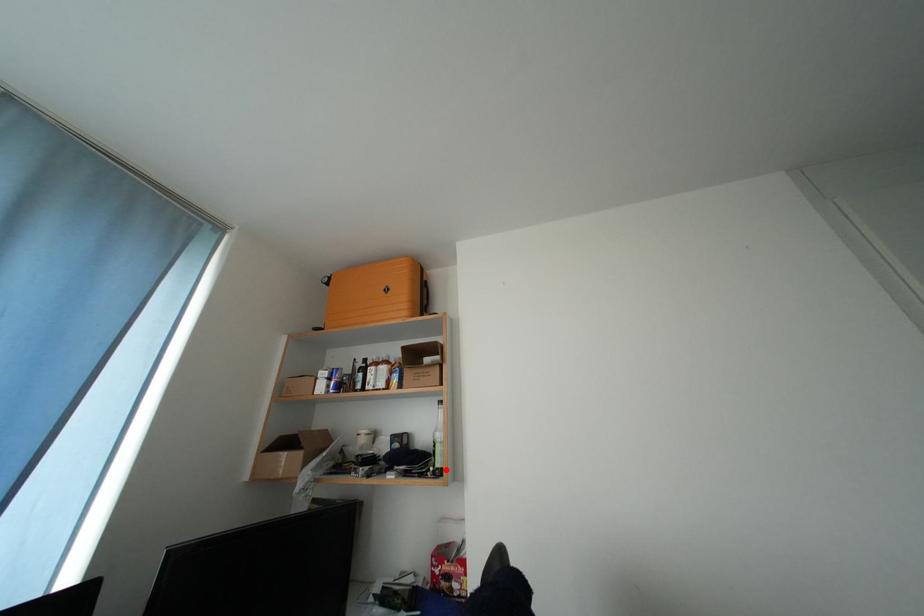
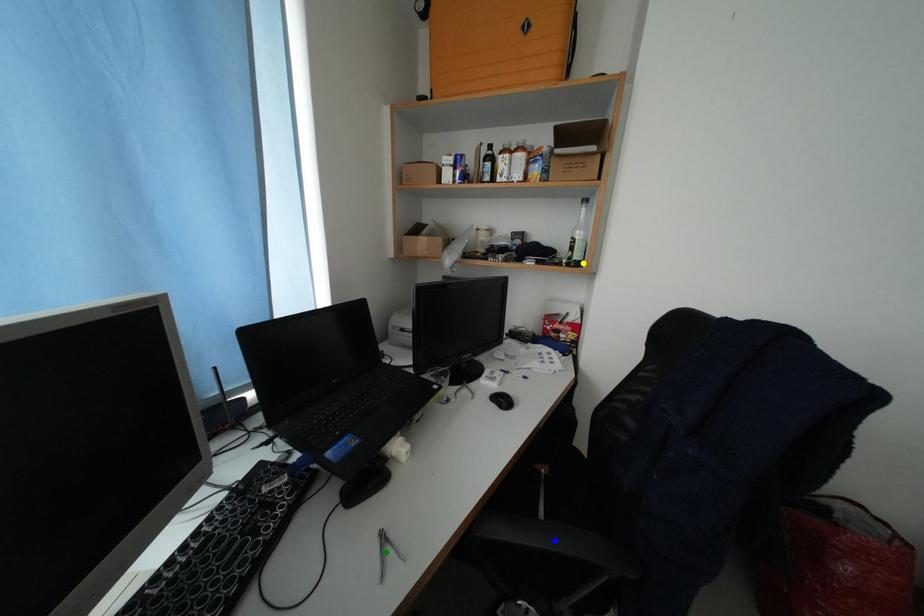
Question: I am providing you with two images of the same scene from different viewpoints. A red point is marked on the first image. You are given multiple points on the second image. Which point in image 2 represents the same 3d spot as the red point in image 1?

Choices:
 (A) green point
 (B) blue point
 (C) yellow point

Answer: (C)